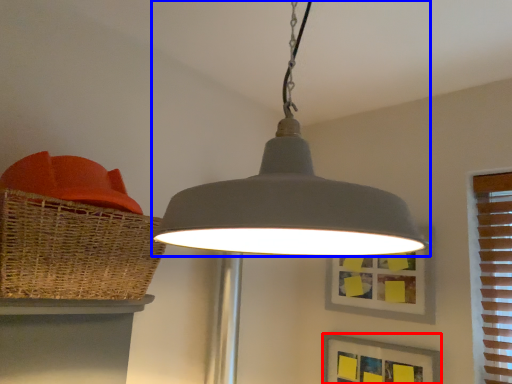
Question: Which point is closer to the camera, picture frame (highlighted by a red box) or lamp (highlighted by a blue box)?

Choices:
 (A) picture frame
 (B) lamp

Answer: (B)